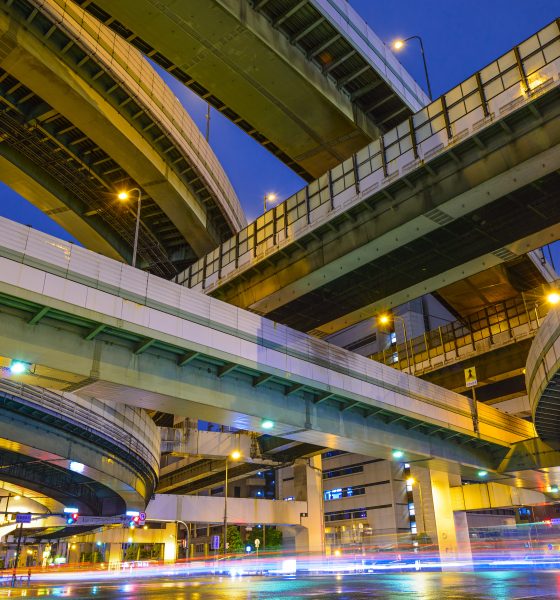
This screenshot has height=600, width=560. I want to click on windows, so click(x=335, y=489), click(x=337, y=515), click(x=344, y=469).